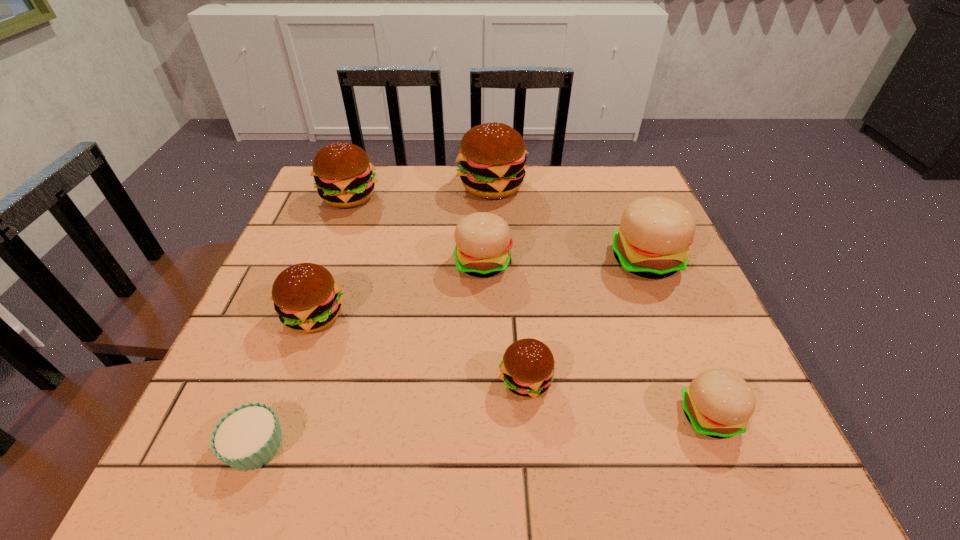
Identify the location of cupcake at the left edge. (247, 437).

Locate an element on the screen. This screenshot has width=960, height=540. object that is at the far left corner is located at coordinates (344, 176).

Identify the location of object at the near left corner. The height and width of the screenshot is (540, 960). (247, 437).

I want to click on object that is at the near right corner, so click(718, 403).

I want to click on free space at the far edge of the desktop, so click(x=417, y=184).

In order to click on vacant region at the near edge in this screenshot , I will do `click(588, 451)`.

Locate an element on the screen. Image resolution: width=960 pixels, height=540 pixels. vacant position at the left edge of the desktop is located at coordinates (349, 226).

Where is `vacant space at the right edge of the desktop`? The image size is (960, 540). vacant space at the right edge of the desktop is located at coordinates (625, 273).

This screenshot has height=540, width=960. Identify the location of free space at the far right corner. (607, 209).

At what (x,y) coordinates should I click in order to perform the action: click on vacant region at the near right corner of the desktop. Please return your answer as a coordinate pair (x, y). The height and width of the screenshot is (540, 960). Looking at the image, I should click on (739, 471).